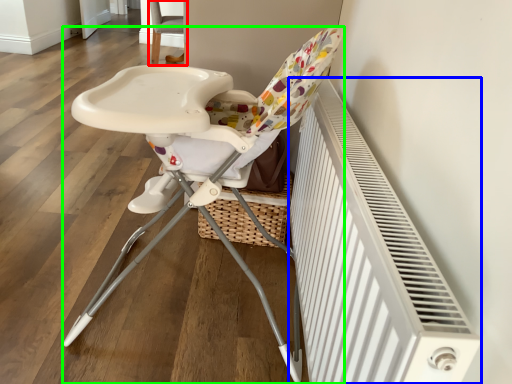
Question: Based on their relative distances, which object is nearer to chair (highlighted by a red box)? Choose from radiator (highlighted by a blue box) and chair (highlighted by a green box).

Choices:
 (A) radiator
 (B) chair

Answer: (B)